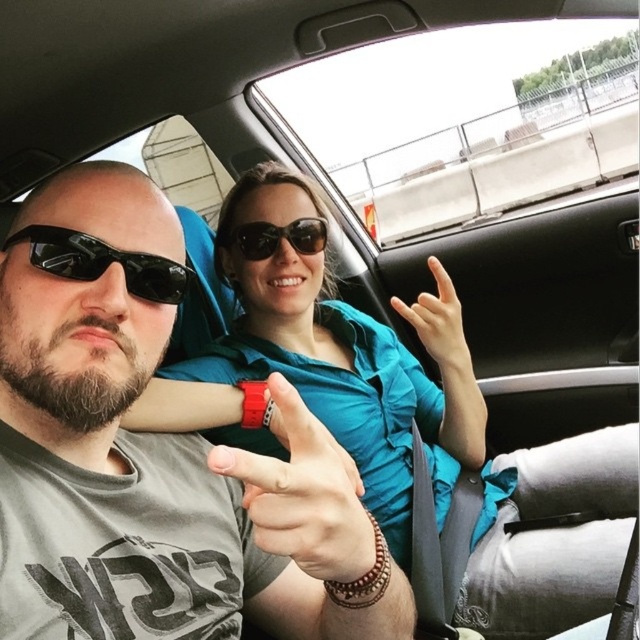
Between point (180, 296) and point (300, 248), which one is positioned in front?

Point (180, 296)

Between point (49, 237) and point (298, 252), which one is positioned behind?

The point (298, 252) is more distant.

Does point (136, 294) lie behind point (268, 241)?

No.

Find the location of a particular element. The image size is (640, 640). black matte sunglasses at left is located at coordinates (102, 262).

Is point (61, 196) less distant than point (83, 280)?

No, (61, 196) is further to viewer.

Where is `gray matte t-shirt at center`? This screenshot has width=640, height=640. gray matte t-shirt at center is located at coordinates (154, 456).

Does gray matte t-shirt at center come in front of matte black sunglasses at center?

Yes, gray matte t-shirt at center is in front of matte black sunglasses at center.

Where is `gray matte t-shirt at center`? This screenshot has width=640, height=640. gray matte t-shirt at center is located at coordinates (154, 456).